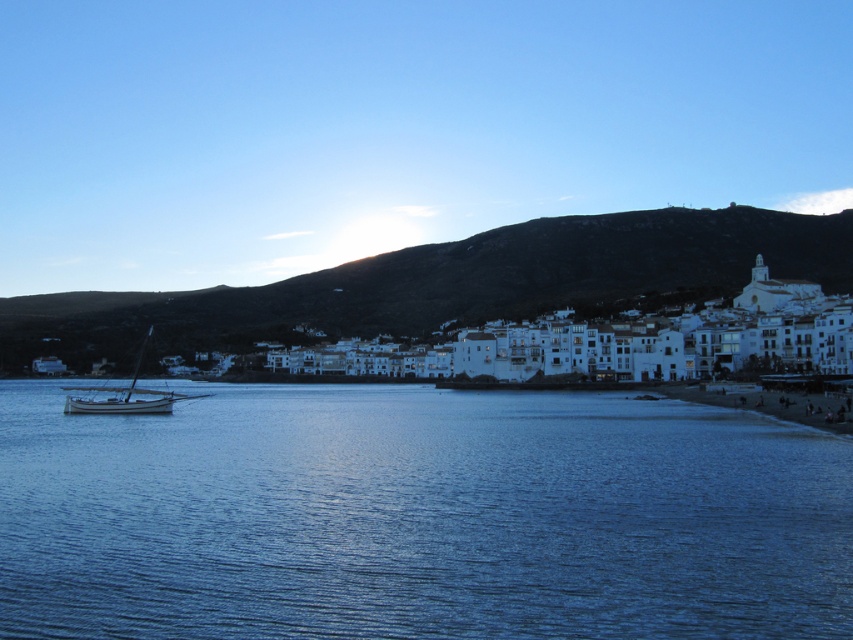
You are an artist planning to paint this coastal scene. You want to ensure the dark green hillside at upper center and the wooden sailboat at left are proportionally accurate. Which object should you make wider in your painting?

The dark green hillside at upper center should be made wider in the painting since its width is larger than that of the wooden sailboat at left according to the description.

You are an observer standing on the shore looking at the blue water at center and the wooden sailboat at left. Which object appears taller from your perspective?

The wooden sailboat at left appears taller than the blue water at center because the blue water at center has a lesser height compared to wooden sailboat at left.

You are an artist planning to paint this coastal scene. You want to ensure that the blue water at center and the dark green hillside at upper center are proportionally accurate. Which object should you make wider in your painting to maintain the scene as shown?

The dark green hillside at upper center should be made wider in the painting since the blue water at center has a lesser width compared to the dark green hillside at upper center.